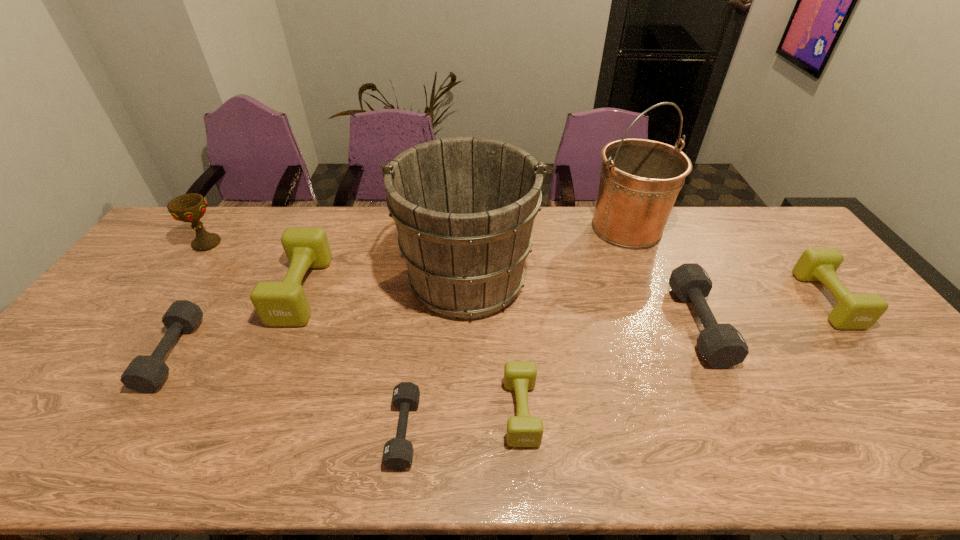
Where is `vacant area located on the back of the rightmost dumbbell`? vacant area located on the back of the rightmost dumbbell is located at coordinates (766, 223).

Identify the location of vacant space positioned 0.120m on the back of the biggest gray dumbbell. Image resolution: width=960 pixels, height=540 pixels. (668, 261).

Image resolution: width=960 pixels, height=540 pixels. I want to click on vacant space located on the right of the leftmost dumbbell, so click(x=310, y=354).

You are a GUI agent. You are given a task and a screenshot of the screen. Output one action in this format:
    pyautogui.click(x=<x>, y=<y>)
    Task: Click on the vacant space located on the left of the smallest olive dumbbell
    This screenshot has height=540, width=960.
    Given the screenshot: What is the action you would take?
    pyautogui.click(x=423, y=411)

This screenshot has width=960, height=540. What are the coordinates of `vacant space situated on the left of the fourth dumbbell from right to left` in the screenshot? It's located at (235, 431).

This screenshot has width=960, height=540. What are the coordinates of `chalice present at the far edge` in the screenshot? It's located at (191, 207).

Where is `object that is at the left edge`? This screenshot has height=540, width=960. object that is at the left edge is located at coordinates (191, 207).

Where is `object that is at the right edge`? Image resolution: width=960 pixels, height=540 pixels. object that is at the right edge is located at coordinates (853, 311).

Find the location of a particular element. object that is at the far left corner is located at coordinates (191, 207).

This screenshot has width=960, height=540. What are the coordinates of `vacant space at the far edge of the desktop` in the screenshot? It's located at (550, 210).